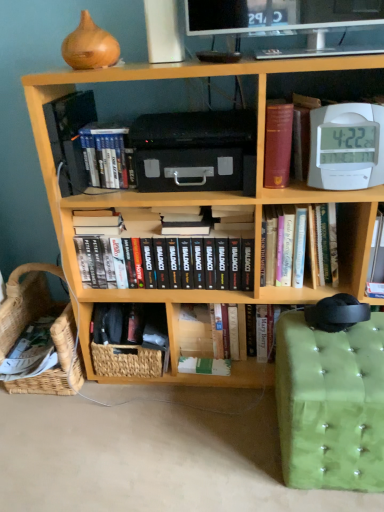
Question: Does hardcover book at center, the second paperback book positioned from the top, have a larger size compared to woven basket at lower left, acting as the 1th basket starting from the right?

Choices:
 (A) yes
 (B) no

Answer: (B)

Question: Is hardcover book at center, the first paperback book in the back-to-front sequence, shorter than woven basket at lower left, the second basket viewed from the left?

Choices:
 (A) yes
 (B) no

Answer: (B)

Question: Is the surface of hardcover book at center, the second paperback book positioned from the top, in direct contact with woven basket at lower left, acting as the 1th basket starting from the right?

Choices:
 (A) no
 (B) yes

Answer: (A)

Question: Are hardcover book at center, the second paperback book positioned from the top, and woven basket at lower left, the second basket viewed from the left, located far from each other?

Choices:
 (A) no
 (B) yes

Answer: (A)

Question: Could woven basket at lower left, acting as the 1th basket starting from the right, be considered to be inside hardcover book at center, the first paperback book in the back-to-front sequence?

Choices:
 (A) yes
 (B) no

Answer: (B)

Question: Could you tell me if hardcover book at center, placed as the 2th paperback book when sorted from bottom to top, is turned towards woven basket at lower left, acting as the 1th basket starting from the right?

Choices:
 (A) no
 (B) yes

Answer: (A)

Question: Is wooden bookcase at center completely or partially outside of green tufted fabric swivel chair at lower right?

Choices:
 (A) no
 (B) yes

Answer: (B)

Question: Can you confirm if wooden bookcase at center is positioned to the right of green tufted fabric swivel chair at lower right?

Choices:
 (A) no
 (B) yes

Answer: (A)

Question: Is wooden bookcase at center facing towards green tufted fabric swivel chair at lower right?

Choices:
 (A) no
 (B) yes

Answer: (B)

Question: Can you confirm if wooden bookcase at center is smaller than green tufted fabric swivel chair at lower right?

Choices:
 (A) yes
 (B) no

Answer: (B)

Question: Is wooden bookcase at center not close to green tufted fabric swivel chair at lower right?

Choices:
 (A) no
 (B) yes

Answer: (A)

Question: Is green tufted fabric swivel chair at lower right completely or partially inside wooden bookcase at center?

Choices:
 (A) no
 (B) yes

Answer: (A)

Question: Considering the relative positions of wooden bookcase at center and woven basket at lower left, the second basket viewed from the left, in the image provided, is wooden bookcase at center to the left of woven basket at lower left, the second basket viewed from the left, from the viewer's perspective?

Choices:
 (A) yes
 (B) no

Answer: (B)